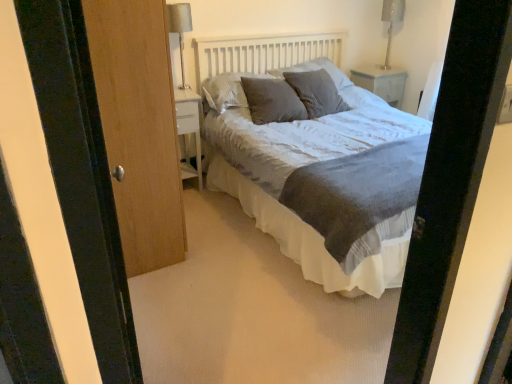
Locate an element on the screen. vacant space to the right of white glossy nightstand at left, placed as the second nightstand when sorted from right to left is located at coordinates (210, 195).